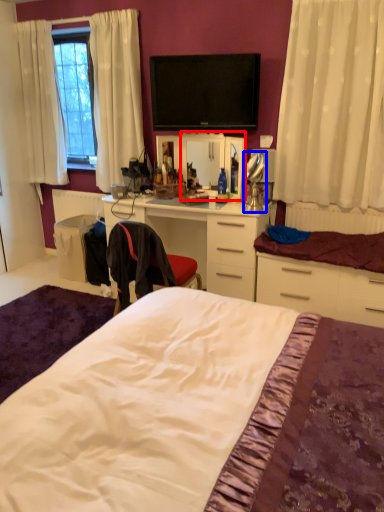
Question: Which of the following is the farthest to the observer, mirror (highlighted by a red box) or table lamp (highlighted by a blue box)?

Choices:
 (A) mirror
 (B) table lamp

Answer: (A)